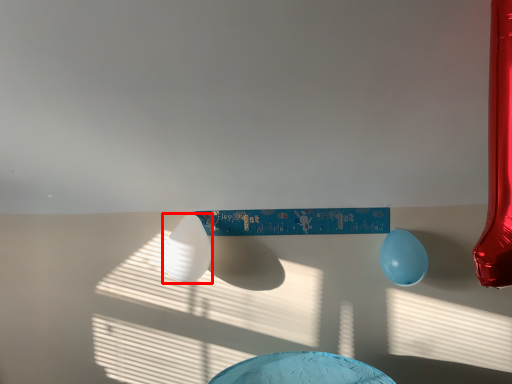
Question: From the image's perspective, where is balloon (annotated by the red box) located in relation to balloon in the image?

Choices:
 (A) below
 (B) above

Answer: (B)